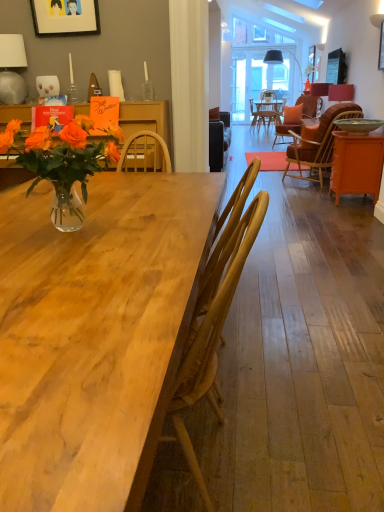
Question: Can you confirm if wooden picture frame at upper right, the 1th picture frame viewed from the back, is thinner than orange woven chair at right, arranged as the 1th chair when viewed from the right?

Choices:
 (A) yes
 (B) no

Answer: (A)

Question: Can you confirm if wooden picture frame at upper right, which is counted as the second picture frame, starting from the left, is positioned to the left of orange woven chair at right, marked as the 1th chair in a top-to-bottom arrangement?

Choices:
 (A) yes
 (B) no

Answer: (B)

Question: Is wooden picture frame at upper right, which is counted as the 1th picture frame, starting from the right, facing away from orange woven chair at right, arranged as the 1th chair when viewed from the right?

Choices:
 (A) yes
 (B) no

Answer: (B)

Question: From a real-world perspective, is wooden picture frame at upper right, which is counted as the second picture frame, starting from the left, positioned under orange woven chair at right, which appears as the second chair when ordered from the bottom, based on gravity?

Choices:
 (A) no
 (B) yes

Answer: (A)

Question: Does wooden picture frame at upper right, the 1th picture frame viewed from the back, turn towards orange woven chair at right, which appears as the second chair when ordered from the bottom?

Choices:
 (A) no
 (B) yes

Answer: (A)

Question: Is wooden picture frame at upper right, which is counted as the second picture frame, starting from the left, bigger than orange woven chair at right, placed as the first chair when sorted from back to front?

Choices:
 (A) no
 (B) yes

Answer: (A)

Question: Does white ceramic lamp at upper left, which ranks as the second lamp in top-to-bottom order, have a greater width compared to orange matte cabinet at right?

Choices:
 (A) no
 (B) yes

Answer: (A)

Question: Is white ceramic lamp at upper left, arranged as the second lamp when viewed from the right, facing away from orange matte cabinet at right?

Choices:
 (A) yes
 (B) no

Answer: (B)

Question: Does white ceramic lamp at upper left, which appears as the 1th lamp when viewed from the left, have a lesser height compared to orange matte cabinet at right?

Choices:
 (A) yes
 (B) no

Answer: (A)

Question: Can we say white ceramic lamp at upper left, which is counted as the first lamp, starting from the bottom, lies outside orange matte cabinet at right?

Choices:
 (A) no
 (B) yes

Answer: (B)

Question: Is the depth of white ceramic lamp at upper left, which ranks as the second lamp in top-to-bottom order, greater than that of orange matte cabinet at right?

Choices:
 (A) no
 (B) yes

Answer: (A)

Question: Is white ceramic lamp at upper left, placed as the first lamp when sorted from front to back, surrounding orange matte cabinet at right?

Choices:
 (A) no
 (B) yes

Answer: (A)

Question: Is translucent glass vase at left to the right of orange woven chair at right, marked as the second chair in a left-to-right arrangement, from the viewer's perspective?

Choices:
 (A) no
 (B) yes

Answer: (A)